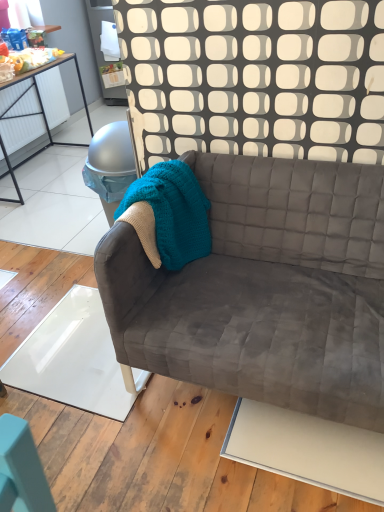
Identify the location of free space above teal knitted blanket at center (from a real-world perspective). (146, 188).